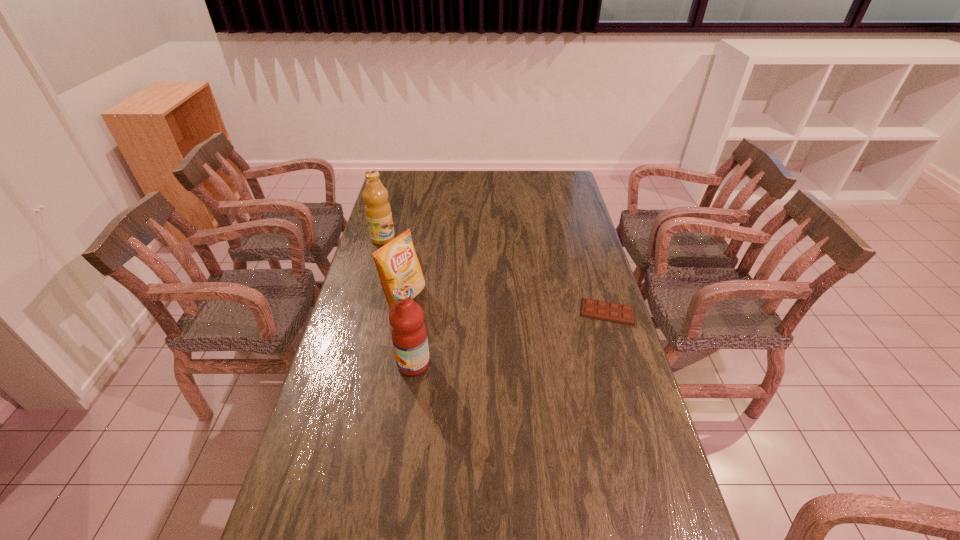
Where is `vacant position located on the front-facing side of the third tallest object`? vacant position located on the front-facing side of the third tallest object is located at coordinates (473, 337).

The width and height of the screenshot is (960, 540). Find the location of `free spot located on the front-facing side of the third tallest object`. free spot located on the front-facing side of the third tallest object is located at coordinates (484, 342).

Locate an element on the screen. free space located on the label of the farthest object is located at coordinates (427, 273).

I want to click on vacant space located on the label of the farthest object, so click(x=413, y=262).

The height and width of the screenshot is (540, 960). In order to click on vacant position located on the label of the farthest object in this screenshot , I will do `click(427, 273)`.

The height and width of the screenshot is (540, 960). Identify the location of crisp (potato chip) located at the left edge. (x=397, y=263).

Where is `olive oil situated at the left edge`? The height and width of the screenshot is (540, 960). olive oil situated at the left edge is located at coordinates (378, 212).

Locate an element on the screen. The image size is (960, 540). object that is at the right edge is located at coordinates (624, 314).

Locate an element on the screen. vacant area at the far edge of the desktop is located at coordinates (450, 184).

I want to click on blank space at the near edge, so click(x=456, y=515).